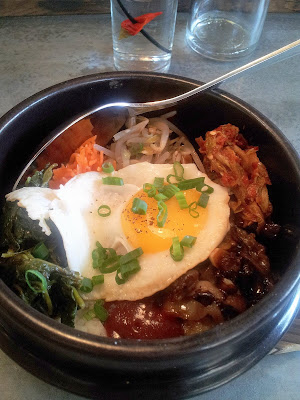
You are a GUI agent. You are given a task and a screenshot of the screen. Output one action in this format:
    pyautogui.click(x=<x>, y=<y>)
    Task: Click on the drinking glasses
    
    Given the screenshot: What is the action you would take?
    pyautogui.click(x=230, y=25), pyautogui.click(x=163, y=18)